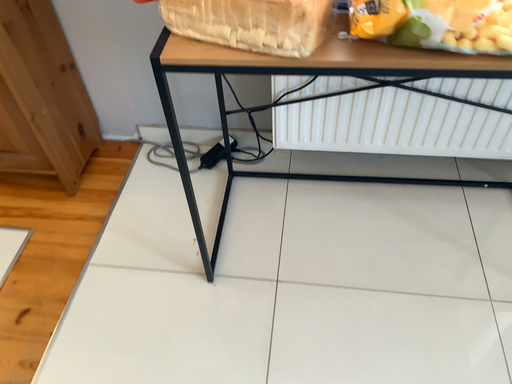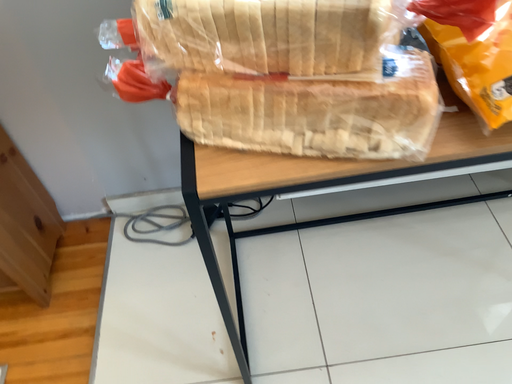
Question: How did the camera likely rotate when shooting the video?

Choices:
 (A) rotated right
 (B) rotated left

Answer: (A)